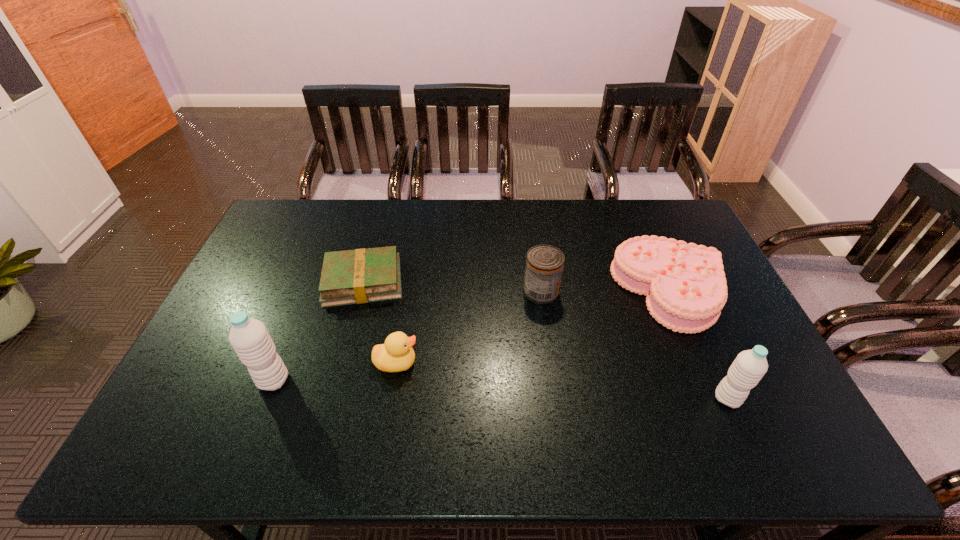
The height and width of the screenshot is (540, 960). Find the location of `the left water bottle`. the left water bottle is located at coordinates (249, 337).

You are a GUI agent. You are given a task and a screenshot of the screen. Output one action in this format:
    pyautogui.click(x=<x>, y=<y>)
    Task: Click on the tallest object
    Image resolution: width=960 pixels, height=540 pixels.
    Given the screenshot: What is the action you would take?
    pyautogui.click(x=249, y=337)

Locate an element on the screen. The height and width of the screenshot is (540, 960). the shorter water bottle is located at coordinates (748, 368).

Where is `the right water bottle`? the right water bottle is located at coordinates (748, 368).

Locate an element on the screen. book is located at coordinates (357, 276).

You are a GUI agent. You are given a task and a screenshot of the screen. Output one action in this format:
    pyautogui.click(x=<x>, y=<y>)
    Task: Click on the can
    This screenshot has width=960, height=540.
    Given the screenshot: What is the action you would take?
    pyautogui.click(x=544, y=263)

Image resolution: width=960 pixels, height=540 pixels. I want to click on the fourth object from left to right, so click(544, 263).

Find the location of `duckling`. duckling is located at coordinates (396, 354).

The image size is (960, 540). Identify the location of cake. (685, 284).

The height and width of the screenshot is (540, 960). In order to click on free spot located 0.050m on the right of the taller water bottle in this screenshot , I will do `click(308, 381)`.